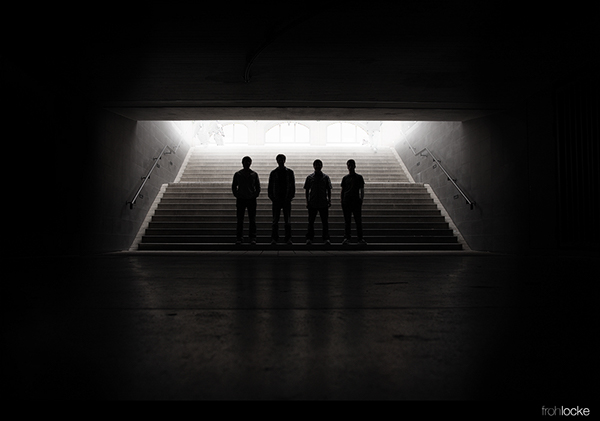
Where is `ceiling`? ceiling is located at coordinates (301, 36).